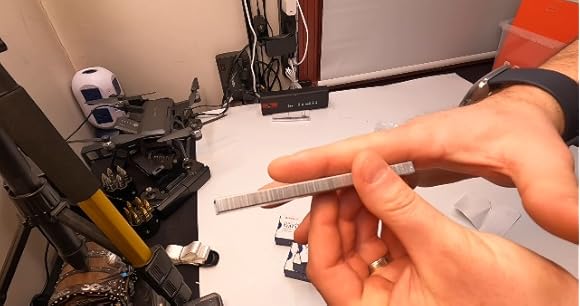
What are the coordinates of `storage bin` in the screenshot? It's located at (502, 29).